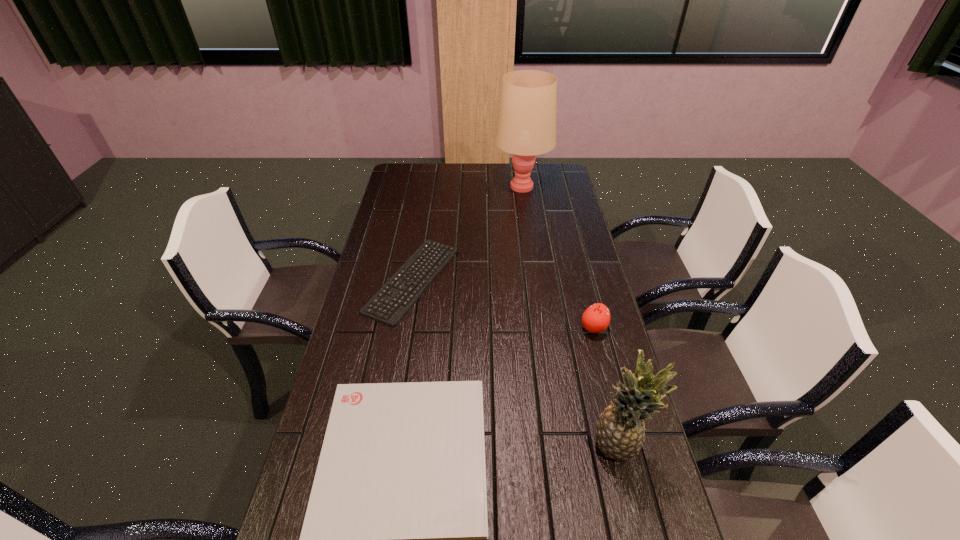
Where is `object that is at the left edge`? Image resolution: width=960 pixels, height=540 pixels. object that is at the left edge is located at coordinates (393, 295).

Locate an element on the screen. The height and width of the screenshot is (540, 960). lampshade at the right edge is located at coordinates (526, 126).

The image size is (960, 540). In order to click on pineapple at the right edge in this screenshot , I will do `click(620, 429)`.

Where is `apple that is at the right edge`? apple that is at the right edge is located at coordinates (596, 318).

The height and width of the screenshot is (540, 960). I want to click on object located at the far right corner, so click(526, 126).

In the image, there is a desktop. Where is `blank space at the far edge`? This screenshot has width=960, height=540. blank space at the far edge is located at coordinates (508, 173).

In order to click on vacant space at the left edge of the desktop in this screenshot , I will do `click(411, 199)`.

Find the location of `vacant space at the right edge`. vacant space at the right edge is located at coordinates (612, 349).

I want to click on free space between the apple and the computer keyboard, so click(503, 304).

You are a GUI agent. You are given a task and a screenshot of the screen. Output one action in this format:
    pyautogui.click(x=<x>, y=<y>)
    Task: Click on the unoccupied position between the lampshade and the third shortest object
    
    Given the screenshot: What is the action you would take?
    pyautogui.click(x=558, y=257)